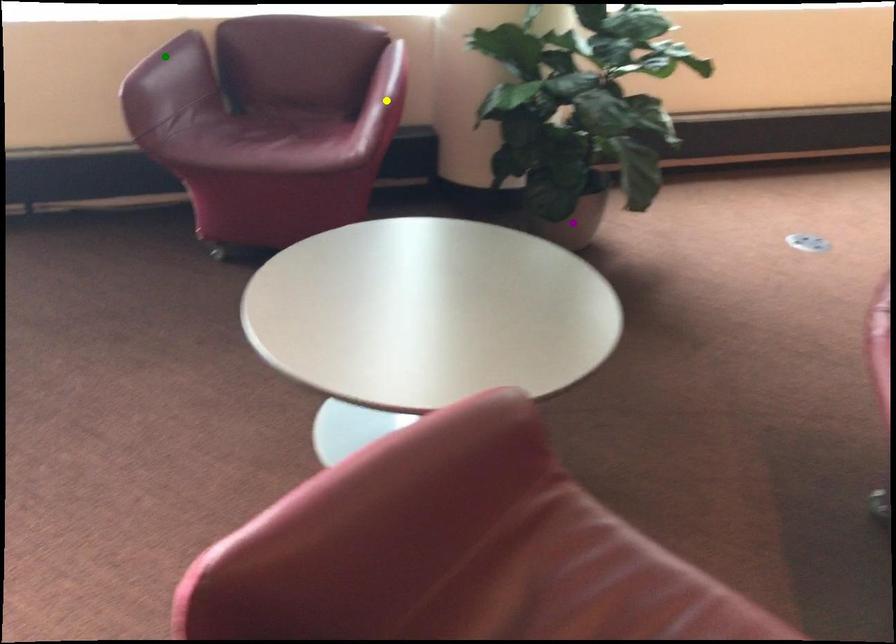
In the scene shown: Order these from nearest to farthest:
A) green point
B) purple point
C) yellow point

1. yellow point
2. green point
3. purple point